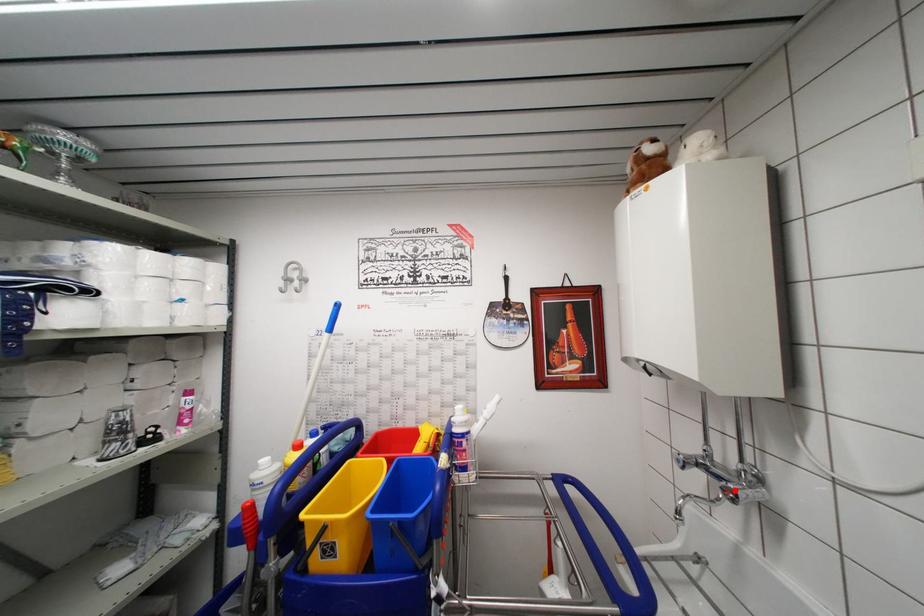
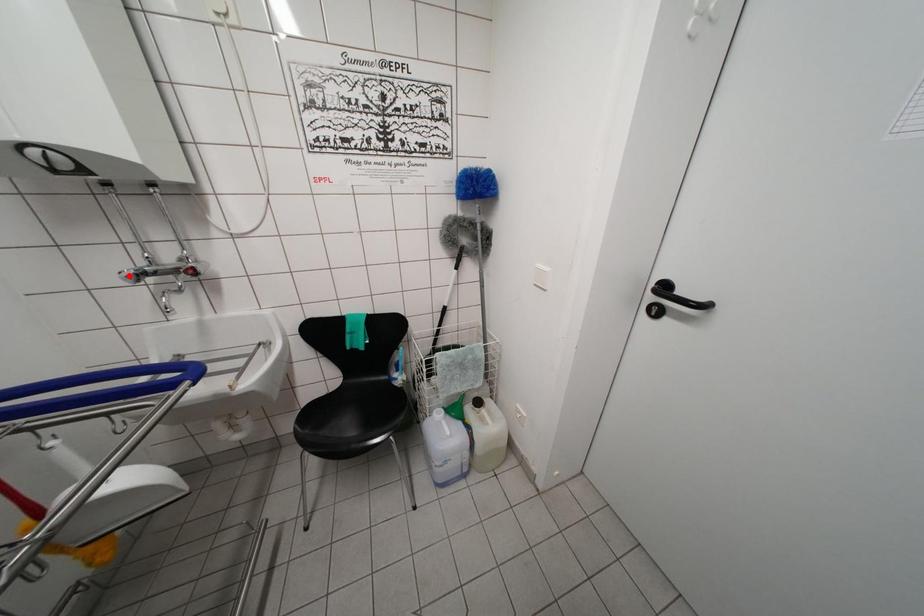
I am providing you with two images of the same scene from different viewpoints. A red point is marked on the first image and another point is marked on the second image. Do the highlighted points in image1 and image2 indicate the same real-world spot?

No